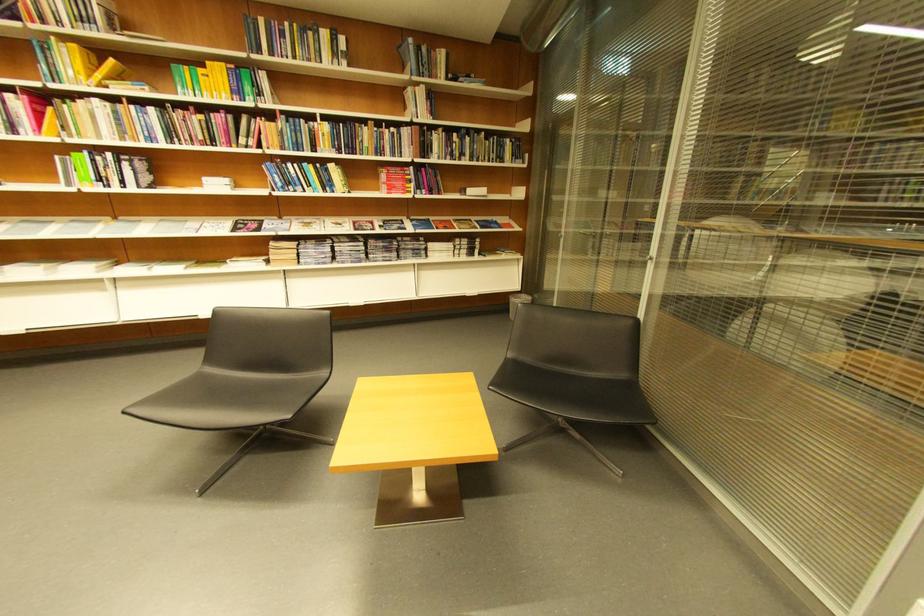
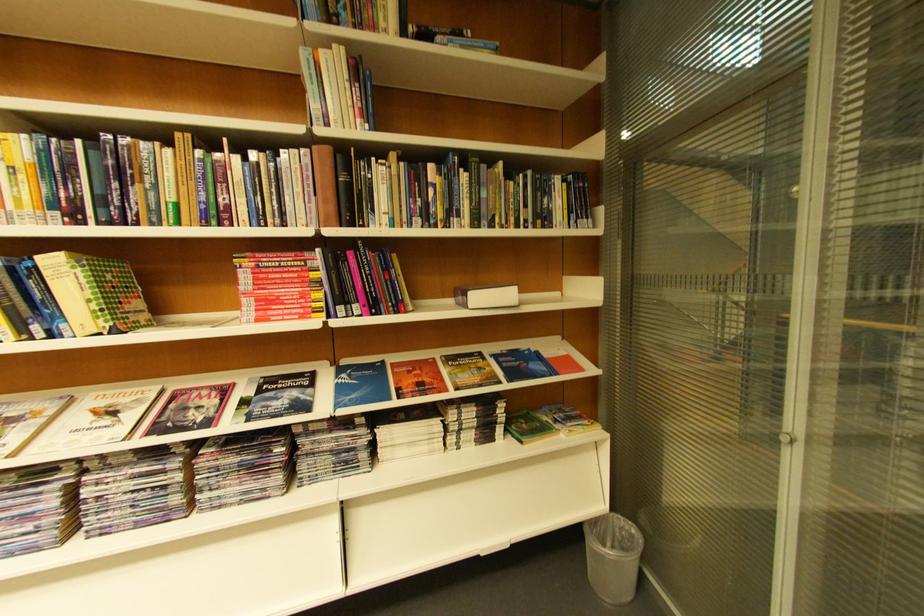
In the second image, find the point that corresponds to [429,147] in the first image.

(342, 196)